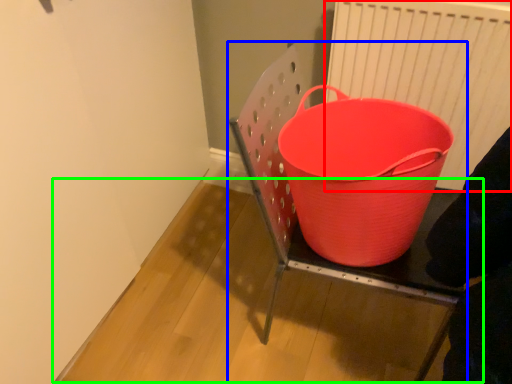
Question: Which is farther away from radiator (highlighted by a red box)? furniture (highlighted by a blue box) or table (highlighted by a green box)?

Choices:
 (A) furniture
 (B) table

Answer: (B)